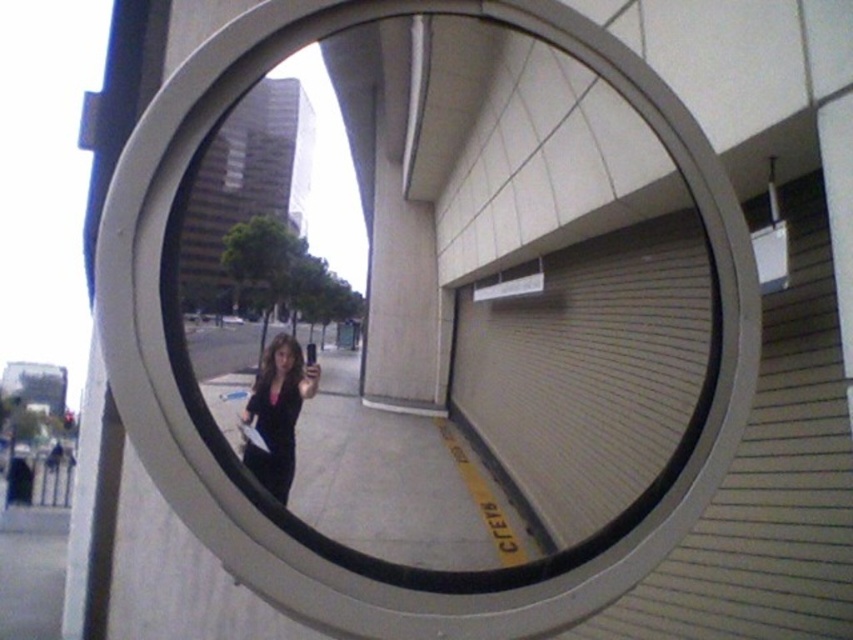
Who is positioned more to the left, clear glass mirror at center or matte black jacket at center?

matte black jacket at center is more to the left.

Between point (430, 138) and point (247, 458), which one is positioned in front?

Point (247, 458)

Where is `clear glass mirror at center`? The height and width of the screenshot is (640, 853). clear glass mirror at center is located at coordinates (544, 269).